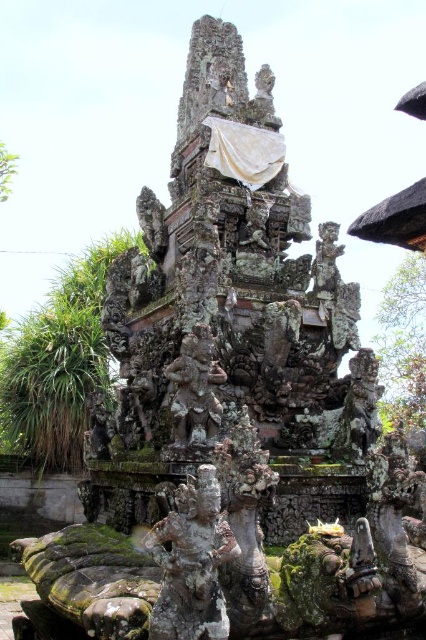
Question: Which point appears farthest from the camera in this image?

Choices:
 (A) (224, 529)
 (B) (322, 272)
 (C) (344, 436)
 (D) (187, 355)

Answer: (B)

Question: Which of the following is the farthest from the observer?

Choices:
 (A) (175, 404)
 (B) (353, 388)
 (C) (195, 612)
 (D) (321, 262)

Answer: (D)

Question: Considering the real-world distances, which object is farthest from the rusty stone statue at center?

Choices:
 (A) green stone statue at center
 (B) carved stone statue at upper center
 (C) bronze statue at center

Answer: (A)

Question: Is green stone statue at center further to camera compared to bronze statue at center?

Choices:
 (A) yes
 (B) no

Answer: (B)

Question: Does green stone statue at center lie behind bronze statue at center?

Choices:
 (A) yes
 (B) no

Answer: (B)

Question: Is green stone statue at center above bronze statue at center?

Choices:
 (A) yes
 (B) no

Answer: (B)